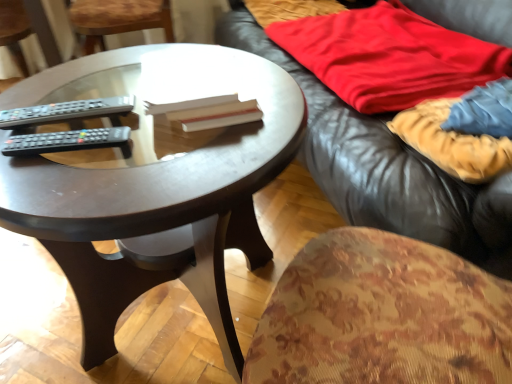
Locate an element on the screen. The width and height of the screenshot is (512, 384). free spot behind black plastic remote at center, marked as the 1th remote control in a back-to-front arrangement is located at coordinates (80, 80).